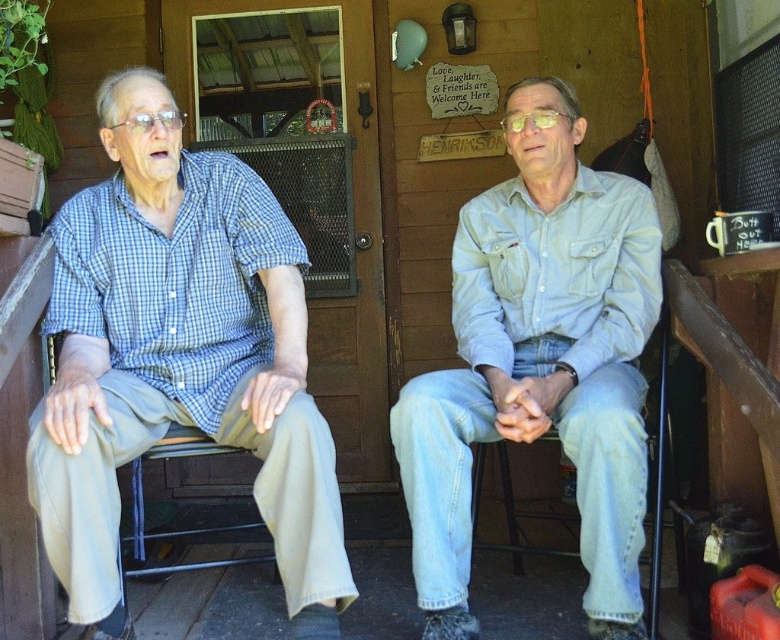
Between matte blue plaid shirt at left and denim jeans at center, which one appears on the right side from the viewer's perspective?

From the viewer's perspective, denim jeans at center appears more on the right side.

This screenshot has height=640, width=780. What do you see at coordinates (176, 355) in the screenshot?
I see `matte blue plaid shirt at left` at bounding box center [176, 355].

In order to click on matte blue plaid shirt at left in this screenshot , I will do `click(176, 355)`.

Is point (509, 320) behind point (658, 456)?

Yes.

Where is `light blue denim jeans at center`? The height and width of the screenshot is (640, 780). light blue denim jeans at center is located at coordinates (539, 362).

Locate an element on the screen. light blue denim jeans at center is located at coordinates (539, 362).

Can you confirm if matte blue plaid shirt at left is taller than light blue denim jeans at center?

Incorrect, matte blue plaid shirt at left's height is not larger of light blue denim jeans at center's.

Between matte blue plaid shirt at left and light blue denim jeans at center, which one has less height?

Standing shorter between the two is matte blue plaid shirt at left.

I want to click on matte blue plaid shirt at left, so click(176, 355).

Locate an element on the screen. matte blue plaid shirt at left is located at coordinates (176, 355).